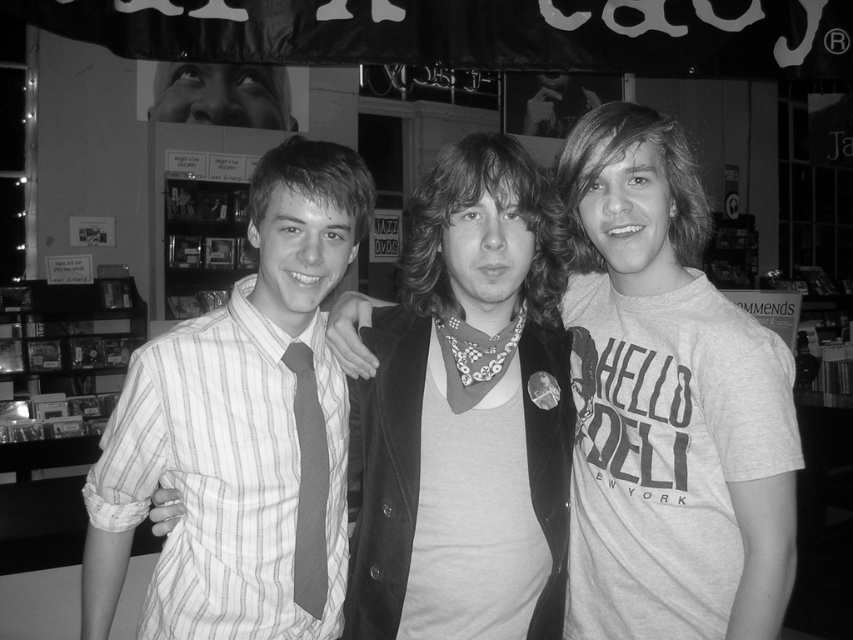
You are a fashion designer observing the image. You need to determine which item, the striped cotton shirt at center or the striped fabric tie at center, would require more fabric to produce. Based on the information provided, which one would you choose?

The striped cotton shirt at center has a larger size compared to the striped fabric tie at center, so it would require more fabric to produce.

You are a photographer who needs to take a photo of the matte black jacket at center. You have a camera that requires the subject to be at least 5 feet away to avoid distortion. Is the camera positioned correctly?

The matte black jacket at center and camera are 4.10 feet apart from each other. Since the required distance is at least 5 feet, the camera is too close and may cause distortion.

You are trying to decide which clothing item to take from the scene for a quick costume change. Since you need something that takes up less space in your bag, which item between the matte black jacket at center and the striped cotton shirt at center should you choose?

The matte black jacket at center is thinner than the striped cotton shirt at center, so you should choose the matte black jacket at center as it takes up less space in your bag.